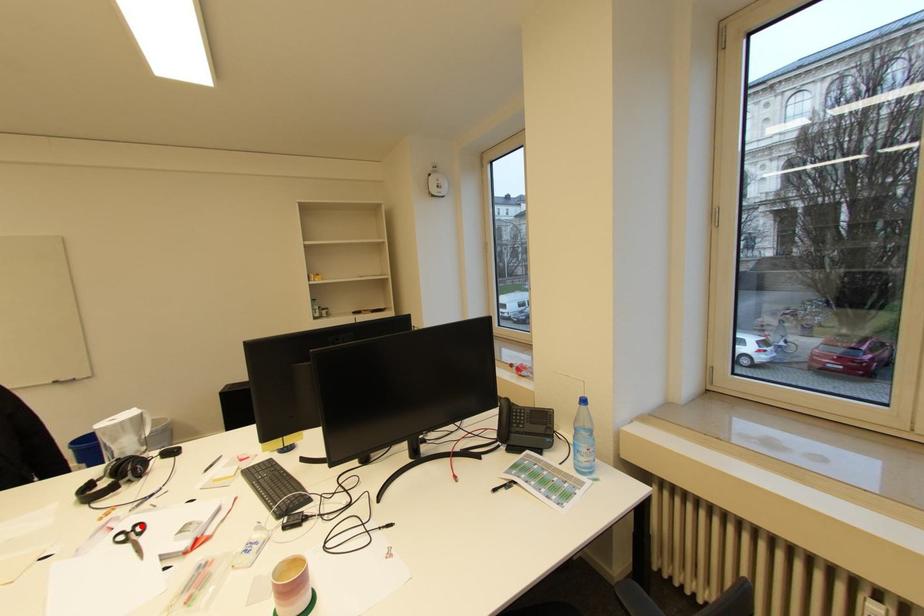
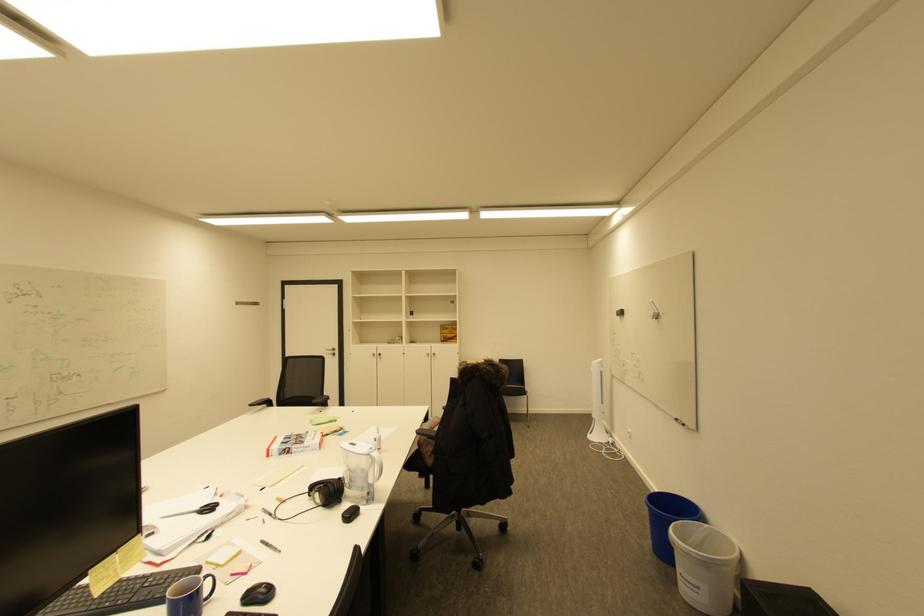
In the second image, find the point that corresponds to the highlighted location in the first image.

(220, 508)